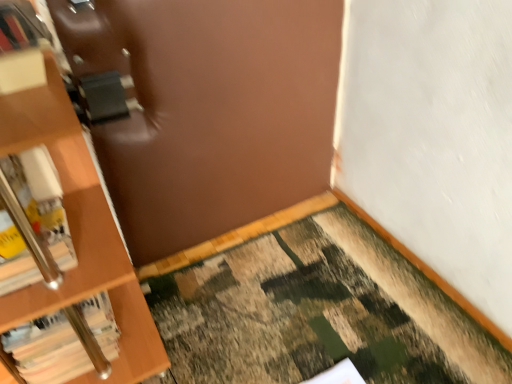
Image resolution: width=512 pixels, height=384 pixels. I want to click on empty space that is ontop of camouflage carpet at lower right, so click(296, 315).